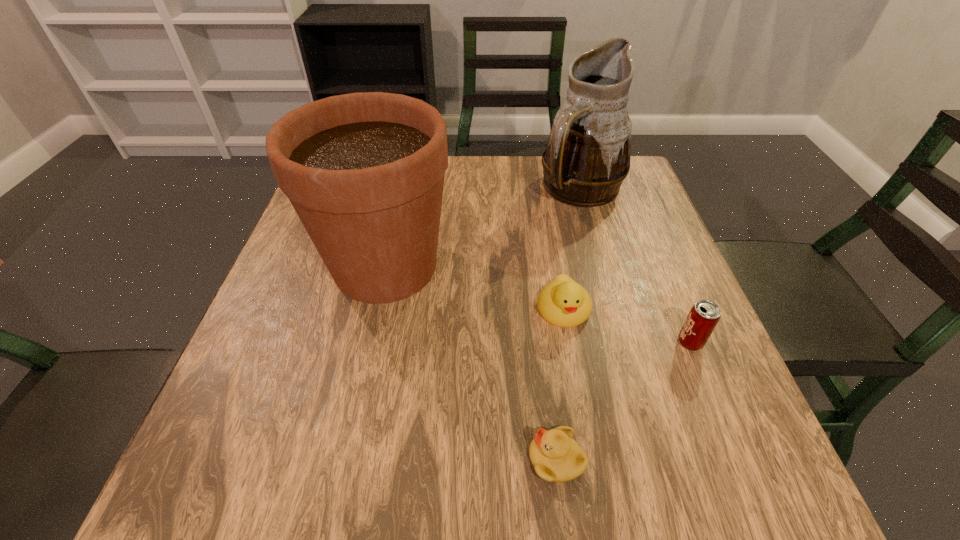
Locate an element on the screen. The height and width of the screenshot is (540, 960). the farthest object is located at coordinates (587, 156).

Locate an element on the screen. This screenshot has height=540, width=960. the leftmost object is located at coordinates (364, 172).

The height and width of the screenshot is (540, 960). What are the coordinates of `beer can` in the screenshot? It's located at (704, 315).

The image size is (960, 540). In order to click on the taller duckling in this screenshot , I will do `click(562, 302)`.

I want to click on the shorter duckling, so click(555, 455).

Image resolution: width=960 pixels, height=540 pixels. Identify the location of the nearest object. (555, 455).

Identify the location of free space located 0.210m from the spout of the pitcher. The width and height of the screenshot is (960, 540). (607, 279).

At what (x,y) coordinates should I click in order to perform the action: click on free spot located 0.220m on the right of the flowerpot. Please return your answer as a coordinate pair (x, y). This screenshot has width=960, height=540. Looking at the image, I should click on (554, 267).

Where is `free spot located on the back of the beer can`? The width and height of the screenshot is (960, 540). free spot located on the back of the beer can is located at coordinates (x=636, y=213).

The width and height of the screenshot is (960, 540). In order to click on vacant space located 0.300m on the face of the taller duckling in this screenshot , I will do coord(597,499).